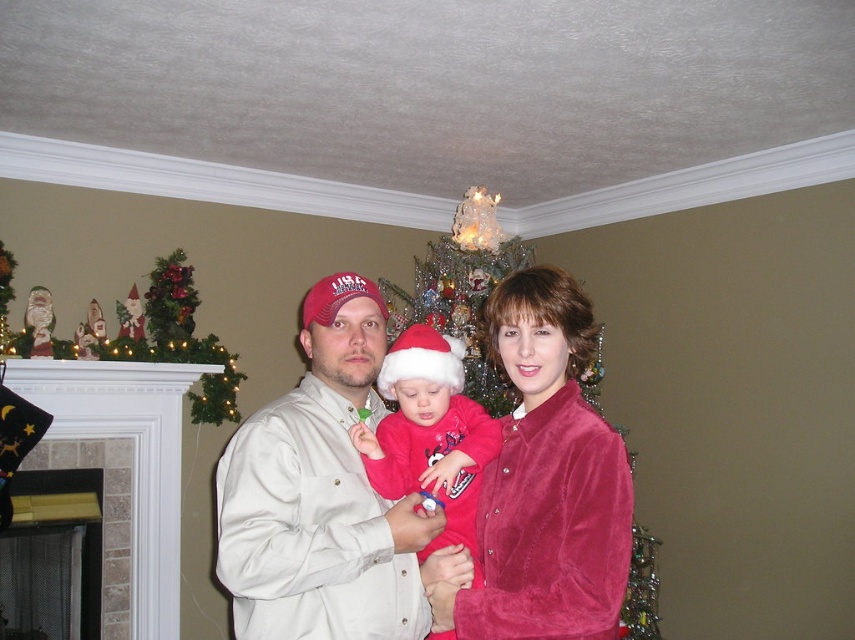
Question: Does white tile fireplace at lower left have a larger size compared to matte pink fabric at center?

Choices:
 (A) yes
 (B) no

Answer: (A)

Question: Which of these objects is positioned farthest from the white tile fireplace at lower left?

Choices:
 (A) matte khaki shirt at center
 (B) wooden figurines at upper left
 (C) matte pink fabric at center

Answer: (C)

Question: Can you confirm if matte khaki shirt at center is positioned to the right of white tile fireplace at lower left?

Choices:
 (A) no
 (B) yes

Answer: (B)

Question: Which object appears farthest from the camera in this image?

Choices:
 (A) matte khaki shirt at center
 (B) matte pink fabric at center
 (C) velvet red shirt at center
 (D) wooden figurines at upper left

Answer: (D)

Question: Is velvet red shirt at center to the right of wooden figurines at upper left from the viewer's perspective?

Choices:
 (A) yes
 (B) no

Answer: (A)

Question: Among these points, which one is farthest from the camera?

Choices:
 (A) (537, 582)
 (B) (166, 616)
 (C) (221, 406)

Answer: (C)